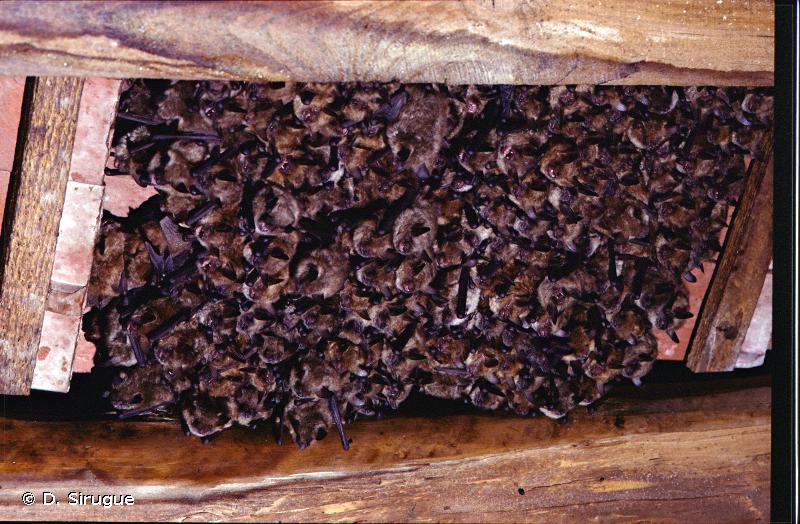
Image resolution: width=800 pixels, height=524 pixels. What are the coordinates of `wood grain` in the screenshot? It's located at (348, 13), (278, 15), (234, 24).